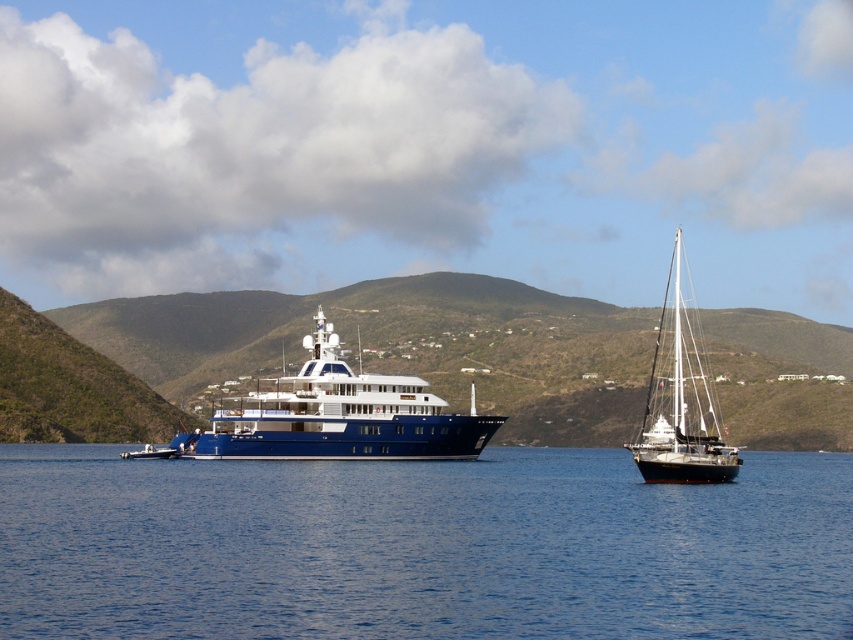
Question: Does blue water at center have a lesser width compared to black matte sailboat at right?

Choices:
 (A) no
 (B) yes

Answer: (A)

Question: Which object is farther from the camera taking this photo?

Choices:
 (A) black matte sailboat at right
 (B) shiny blue yacht at center

Answer: (B)

Question: Which point is closer to the camera taking this photo?

Choices:
 (A) (223, 465)
 (B) (683, 404)

Answer: (B)

Question: Is blue water at center smaller than black matte sailboat at right?

Choices:
 (A) yes
 (B) no

Answer: (A)

Question: Among these points, which one is farthest from the camera?

Choices:
 (A) (260, 550)
 (B) (698, 477)

Answer: (B)

Question: Is blue water at center further to camera compared to black matte sailboat at right?

Choices:
 (A) no
 (B) yes

Answer: (A)